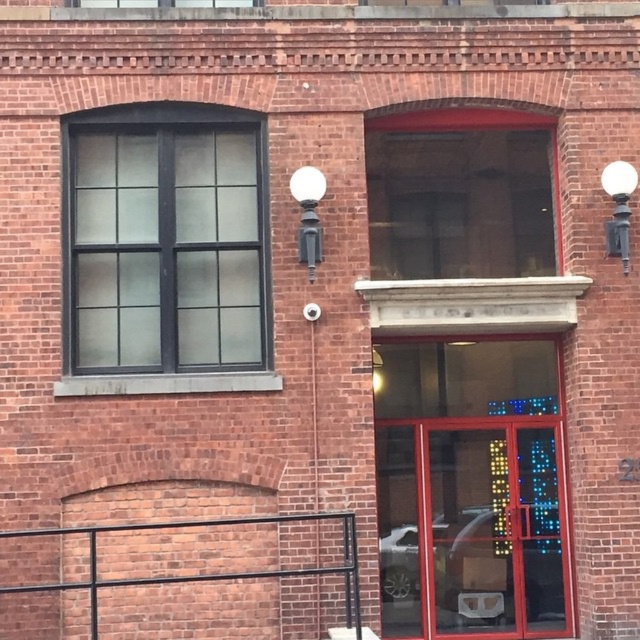
In the scene shown: You are standing at the entrance of the brick building and want to take a photo of the black glass window at upper left. Your camera is 26.43 feet away from the window. Is the camera close enough to capture the entire window in one shot?

The black glass window at upper left and camera are 26.43 feet apart, so the camera is at the correct distance to capture the entire window in one shot since they are exactly 26.43 feet apart.

You are a delivery person trying to park your 24 inch wide cart between the black glass window at upper left and the white glossy streetlamp at upper center. Can you fit your cart in the space between them?

The space between the black glass window at upper left and the white glossy streetlamp at upper center is 20.40 inches. Since your cart is 24 inches wide, it is wider than the available space. Therefore, you cannot fit your cart between them.